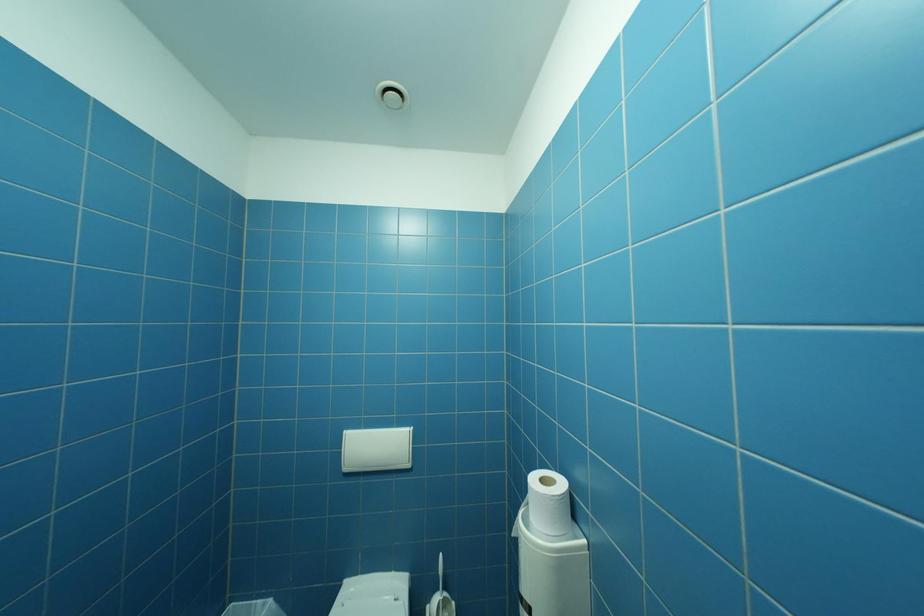
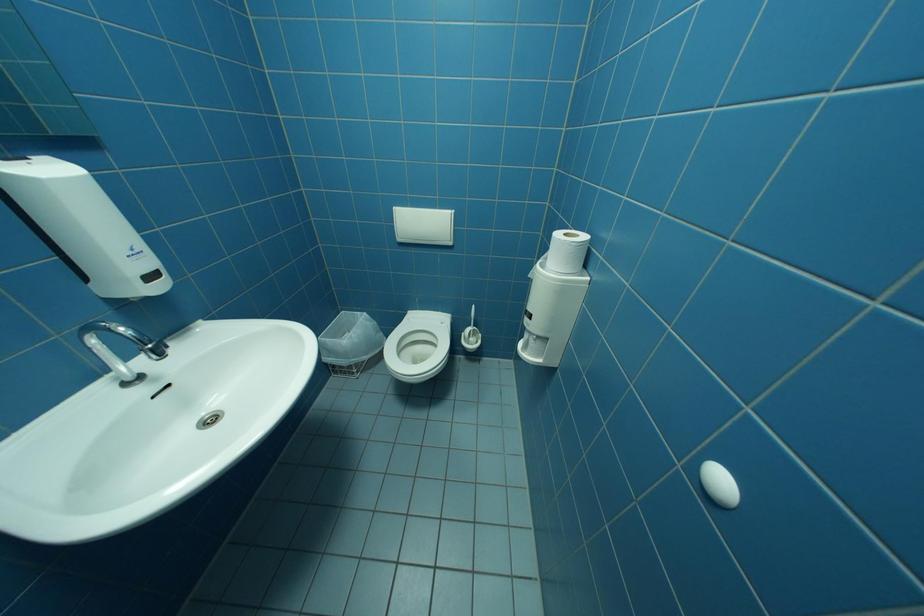
Question: The first image is from the beginning of the video and the second image is from the end. How did the camera likely rotate when shooting the video?

Choices:
 (A) Left
 (B) Right
 (C) Up
 (D) Down

Answer: (D)